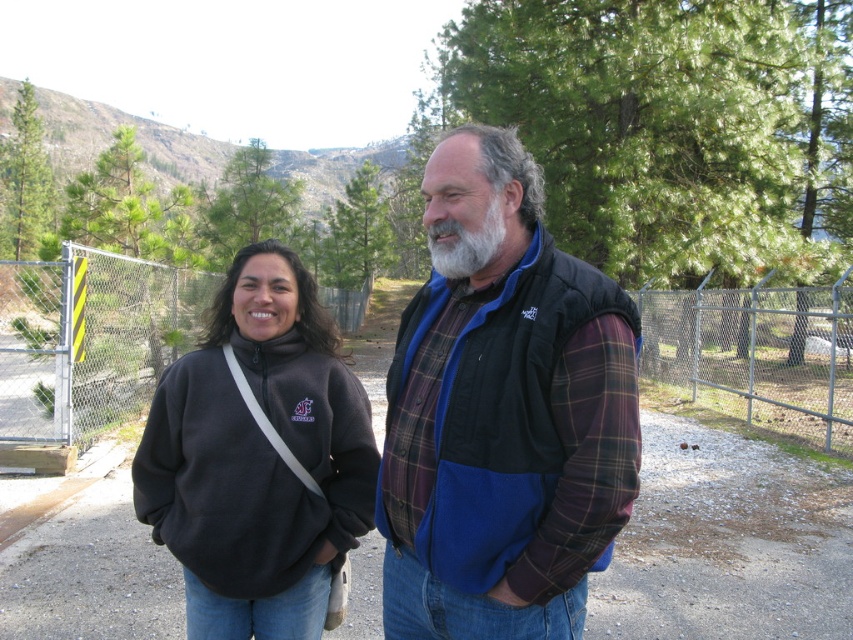
Question: Does dark fleece sweatshirt at center appear over metal chain-link fence at left?

Choices:
 (A) yes
 (B) no

Answer: (B)

Question: Is dark fleece sweatshirt at center below graywoollybeard at center?

Choices:
 (A) yes
 (B) no

Answer: (A)

Question: Which object appears farthest from the camera in this image?

Choices:
 (A) graywoollybeard at center
 (B) metal mesh fence at right
 (C) dark fleece sweatshirt at center

Answer: (B)

Question: Which is farther from the metal chain-link fence at left?

Choices:
 (A) metal mesh fence at right
 (B) graywoollybeard at center
 (C) dark fleece sweatshirt at center
 (D) plaid fleece vest at center

Answer: (B)

Question: Does dark fleece sweatshirt at center appear on the right side of graywoollybeard at center?

Choices:
 (A) yes
 (B) no

Answer: (B)

Question: Estimate the real-world distances between objects in this image. Which object is closer to the plaid fleece vest at center?

Choices:
 (A) dark fleece sweatshirt at center
 (B) graywoollybeard at center
 (C) metal chain-link fence at left

Answer: (B)